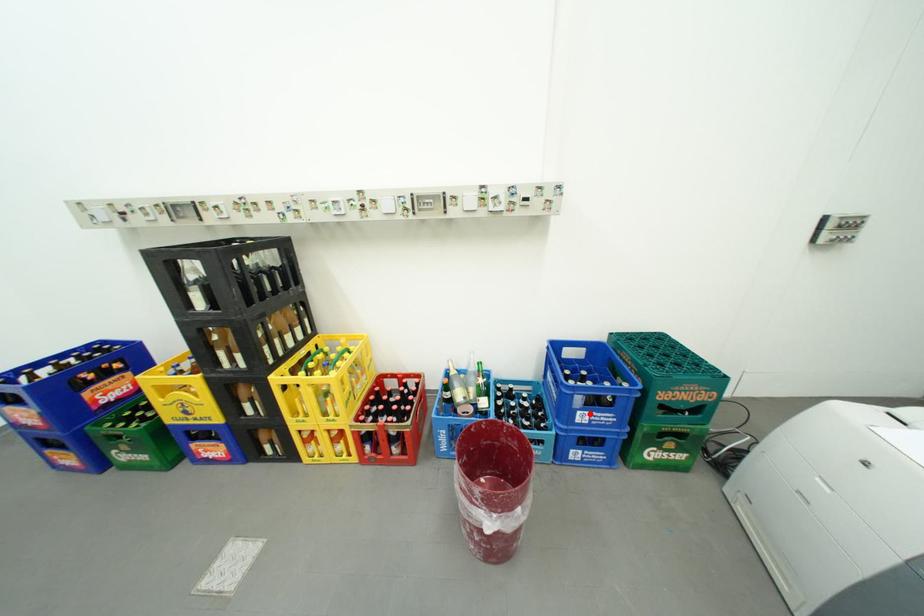
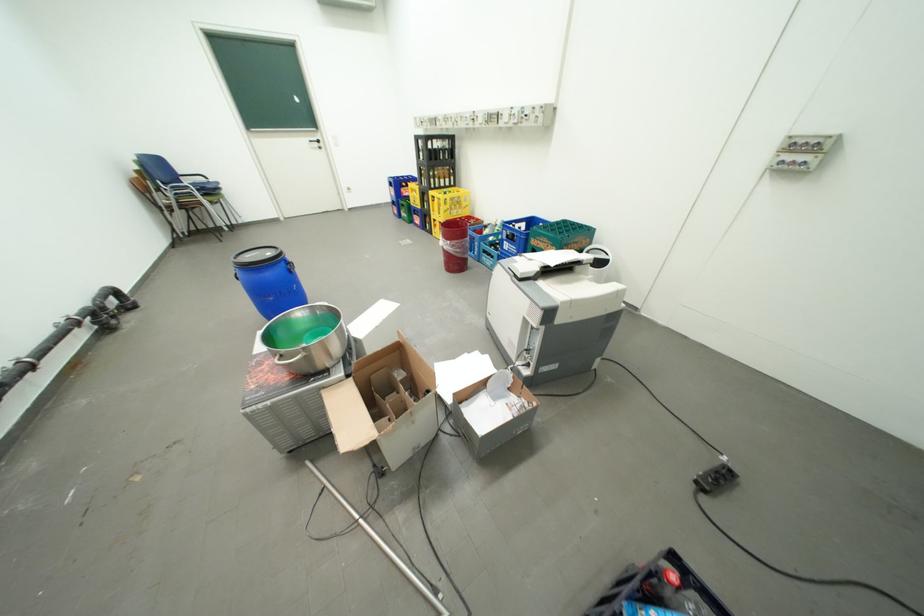
The point at the highlighted location is marked in the first image. Where is the corresponding point in the second image?

(516, 244)